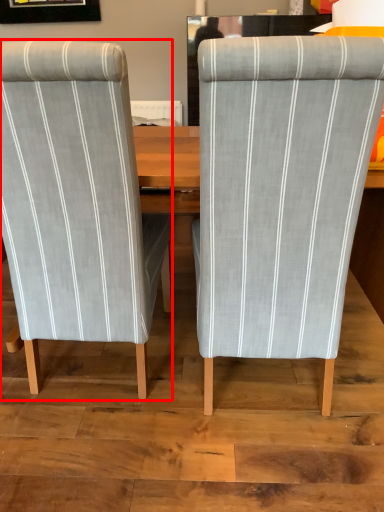
Question: From the image's perspective, what is the correct spatial positioning of chair (annotated by the red box) in reference to chair?

Choices:
 (A) below
 (B) above

Answer: (B)